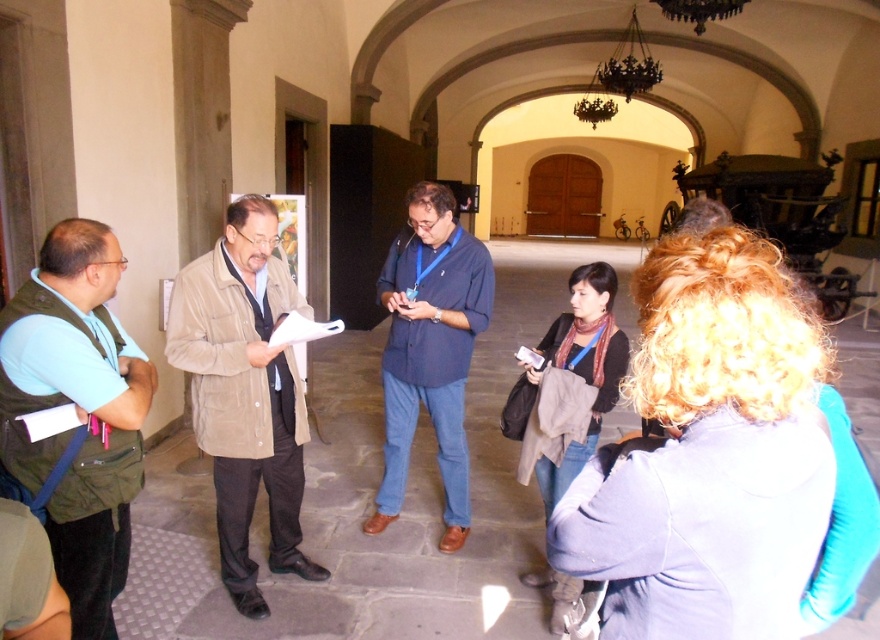
Question: Is the position of green fabric vest at left less distant than that of blue shirt at center?

Choices:
 (A) no
 (B) yes

Answer: (B)

Question: Which is nearer to the blue shirt at center?

Choices:
 (A) green fabric vest at left
 (B) suede jacket at center

Answer: (B)

Question: Can you confirm if suede jacket at center is thinner than blue shirt at center?

Choices:
 (A) no
 (B) yes

Answer: (B)

Question: Which object is closer to the camera taking this photo?

Choices:
 (A) green fabric vest at left
 (B) blue shirt at center

Answer: (A)

Question: Which object is the closest to the suede jacket at center?

Choices:
 (A) blue shirt at center
 (B) green fabric vest at left

Answer: (B)

Question: Is green fabric vest at left thinner than blue shirt at center?

Choices:
 (A) yes
 (B) no

Answer: (A)